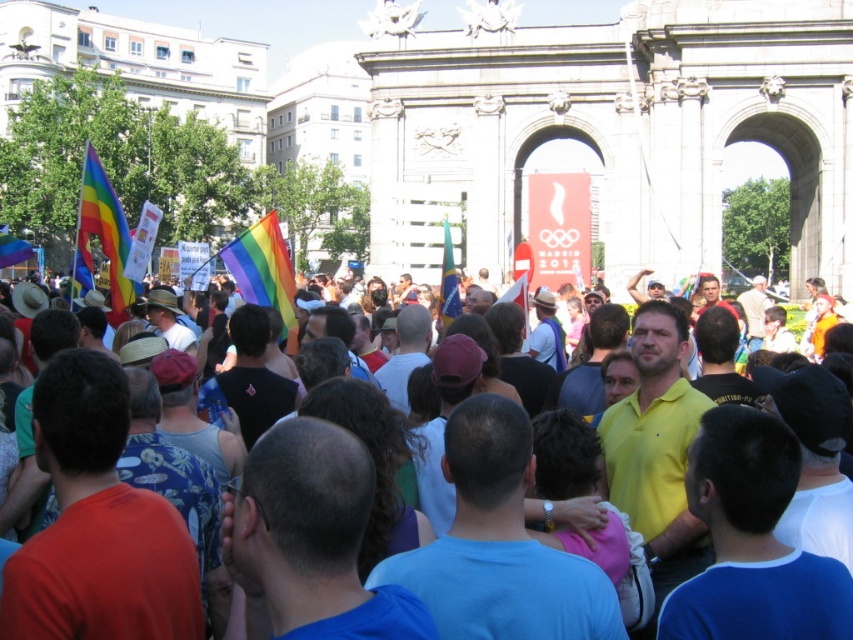
Who is shorter, rainbow fabric flag at center or blue fabric flag at center?

Standing shorter between the two is blue fabric flag at center.

Which is behind, point (242, 236) or point (444, 250)?

The point (444, 250) is behind.

This screenshot has width=853, height=640. Identify the location of rainbow fabric flag at center. (263, 269).

Is the position of blue fabric flag at center less distant than that of rainbow fabric flag at upper left?

Yes, it is in front of rainbow fabric flag at upper left.

Between blue fabric flag at center and rainbow fabric flag at upper left, which one is positioned lower?

blue fabric flag at center

This screenshot has height=640, width=853. In order to click on blue fabric flag at center in this screenshot , I will do `click(448, 282)`.

Between rainbow fabric flag at left and rainbow fabric flag at upper left, which one appears on the right side from the viewer's perspective?

From the viewer's perspective, rainbow fabric flag at left appears more on the right side.

Can you confirm if rainbow fabric flag at left is thinner than rainbow fabric flag at upper left?

In fact, rainbow fabric flag at left might be wider than rainbow fabric flag at upper left.

The height and width of the screenshot is (640, 853). I want to click on rainbow fabric flag at left, so click(x=102, y=237).